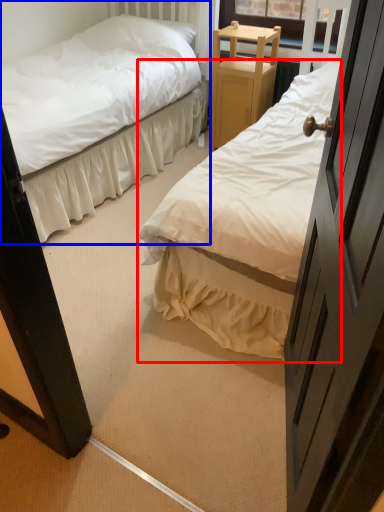
Question: Among these objects, which one is farthest to the camera, bed (highlighted by a red box) or bed (highlighted by a blue box)?

Choices:
 (A) bed
 (B) bed

Answer: (B)